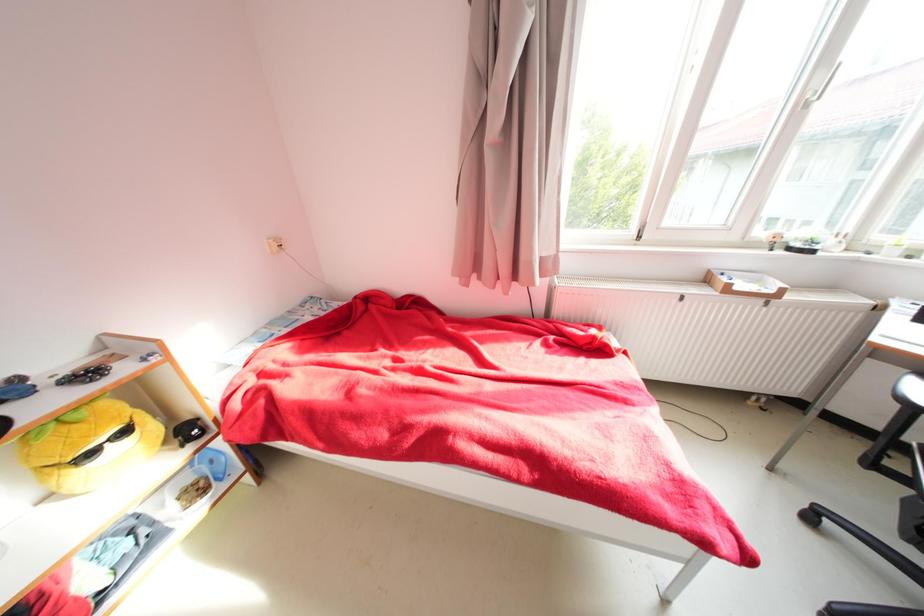
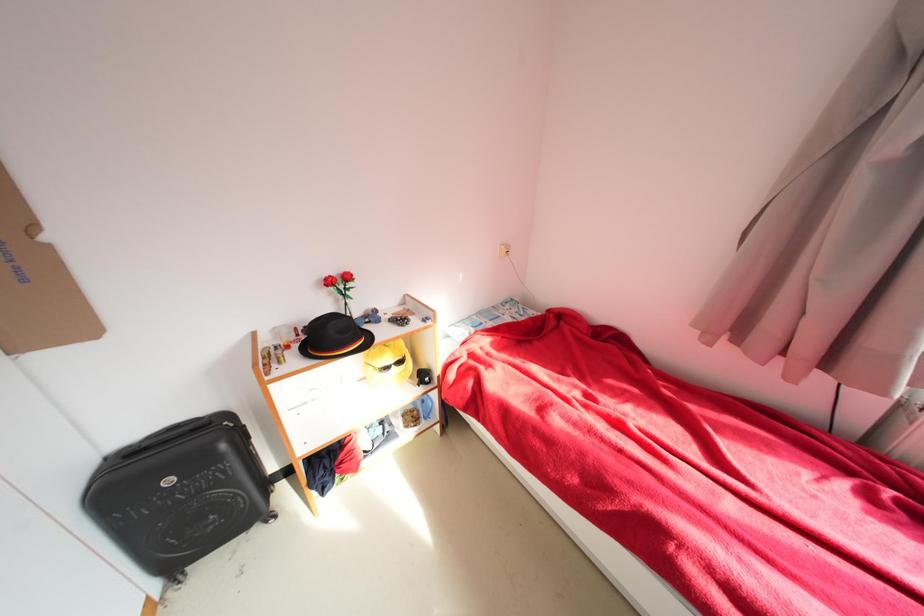
Question: How did the camera likely rotate?

Choices:
 (A) Left
 (B) Right
 (C) Up
 (D) Down

Answer: (A)